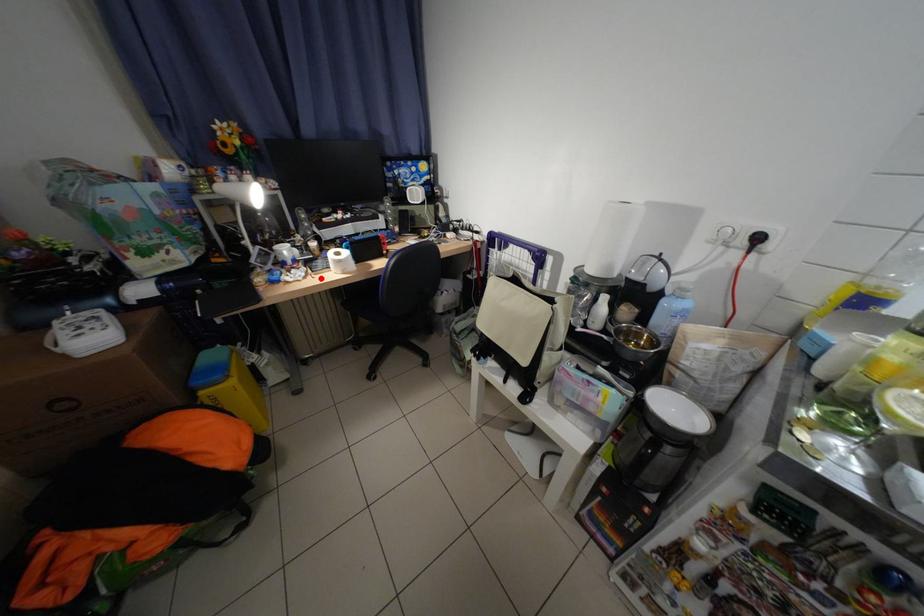
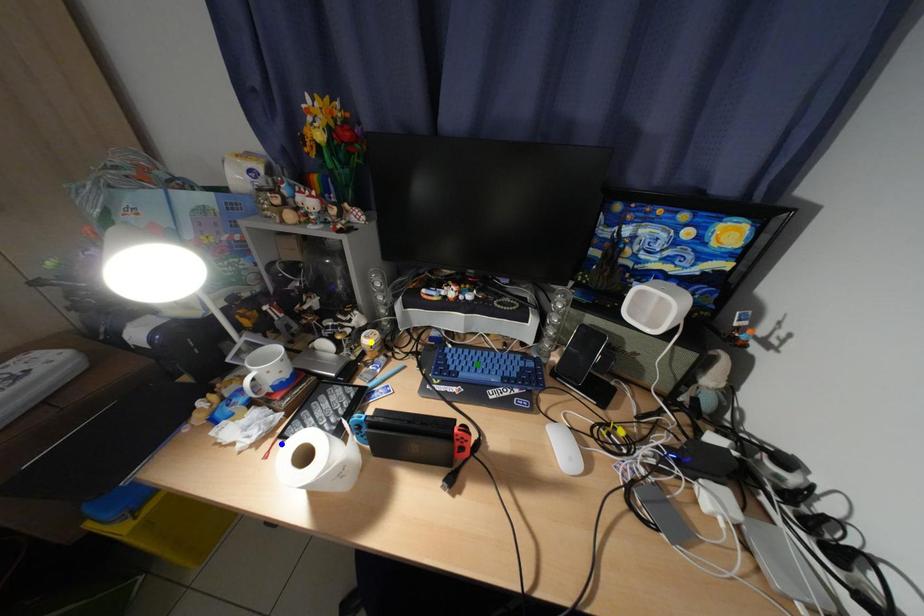
Question: I am providing you with two images of the same scene from different viewpoints. A red point is marked on the first image. You are given multiple points on the second image. Can you choose the point in image 2 that corresponds to the point in image 1?

Choices:
 (A) blue point
 (B) green point
 (C) yellow point

Answer: (A)